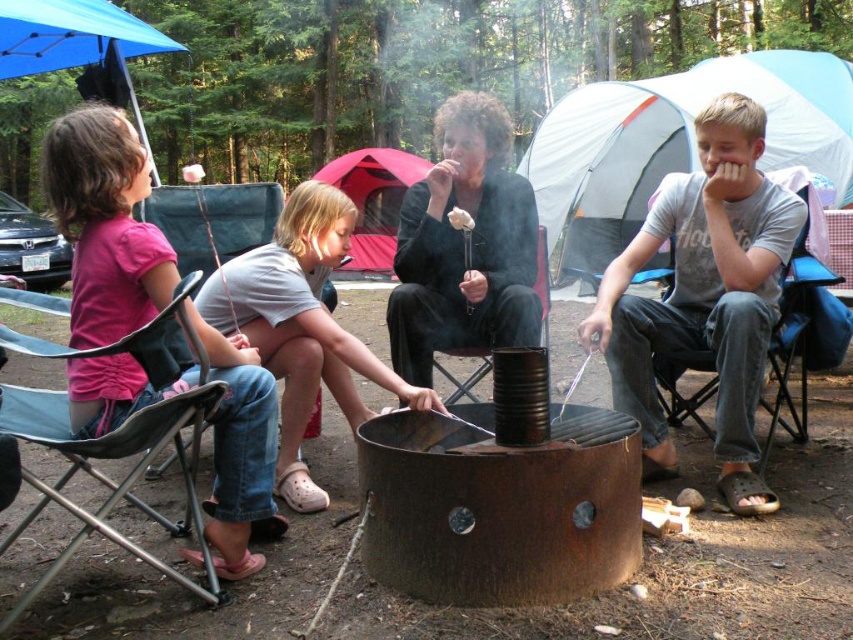
Can you confirm if blue fabric chair at lower left is positioned above blue fabric chair at left?

Incorrect, blue fabric chair at lower left is not positioned above blue fabric chair at left.

Who is positioned more to the left, blue fabric chair at lower left or blue fabric chair at left?

blue fabric chair at lower left is more to the left.

Who is more forward, (x=186, y=499) or (x=201, y=284)?

Positioned in front is point (x=186, y=499).

This screenshot has height=640, width=853. Identify the location of blue fabric chair at lower left. (107, 477).

Who is taller, matte black jacket at center or blue fabric chair at left?

With more height is matte black jacket at center.

Measure the distance between matte black jacket at center and camera.

The distance of matte black jacket at center from camera is 2.21 meters.

You are a GUI agent. You are given a task and a screenshot of the screen. Output one action in this format:
    pyautogui.click(x=<x>, y=<y>)
    Task: Click on the matte black jacket at center
    This screenshot has width=853, height=640.
    Given the screenshot: What is the action you would take?
    pyautogui.click(x=732, y=186)

The width and height of the screenshot is (853, 640). In order to click on matte black jacket at center in this screenshot , I will do `click(732, 186)`.

Does point (785, 323) lie in front of point (312, 509)?

No, (785, 323) is further to viewer.

At what (x,y) coordinates should I click in order to perform the action: click on black fabric chair at right. Please return your answer as a coordinate pair (x, y). This screenshot has width=853, height=640. Looking at the image, I should click on (804, 320).